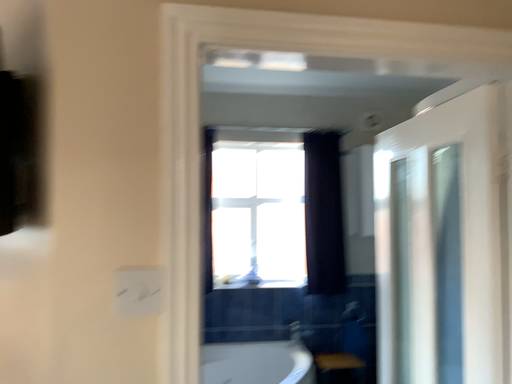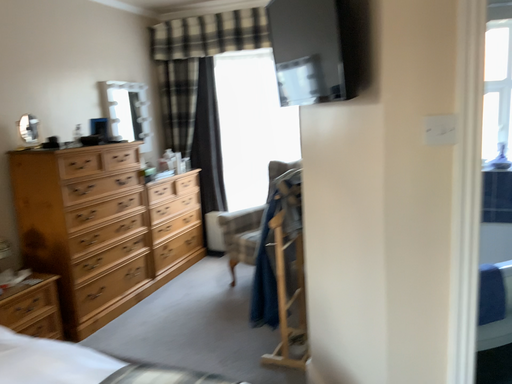
Question: How did the camera likely rotate when shooting the video?

Choices:
 (A) rotated left
 (B) rotated right

Answer: (A)